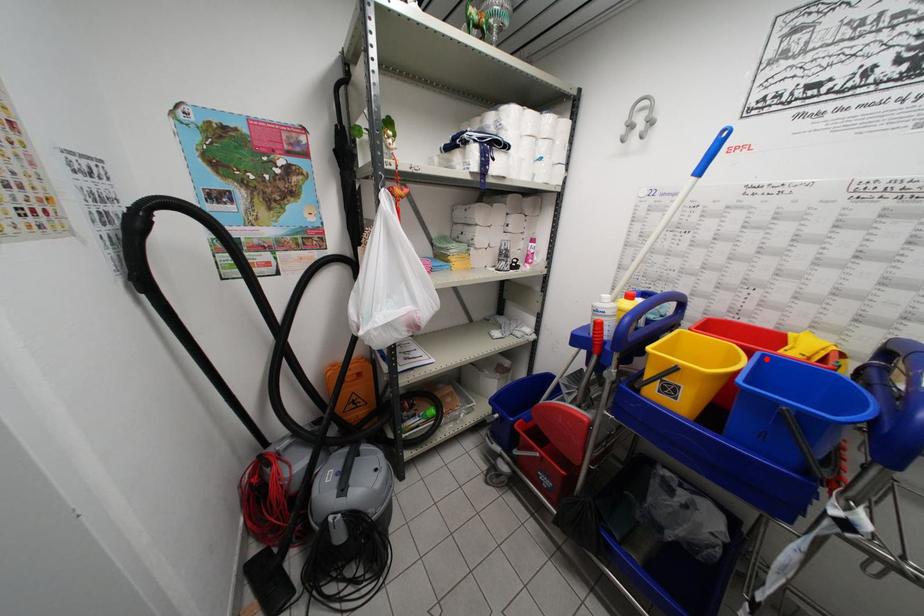
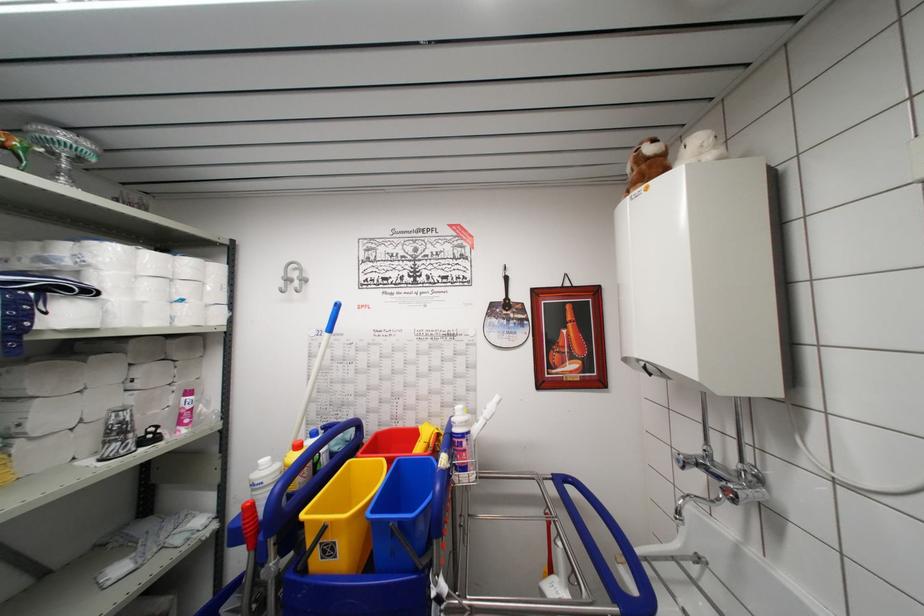
The point at the highlighted location is marked in the first image. Where is the corresponding point in the second image?

(402, 466)